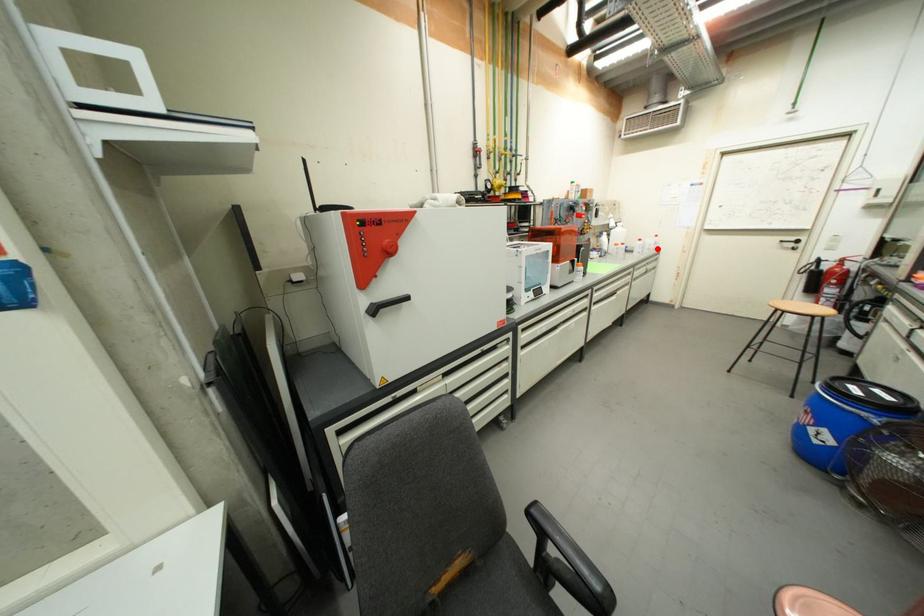
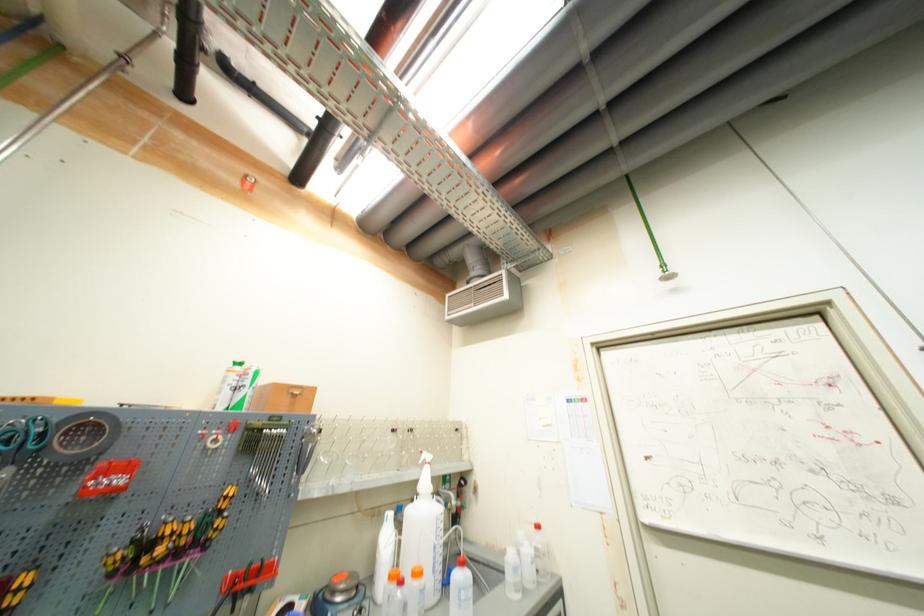
The point at the highlighted location is marked in the first image. Where is the corresponding point in the second image?

(533, 578)